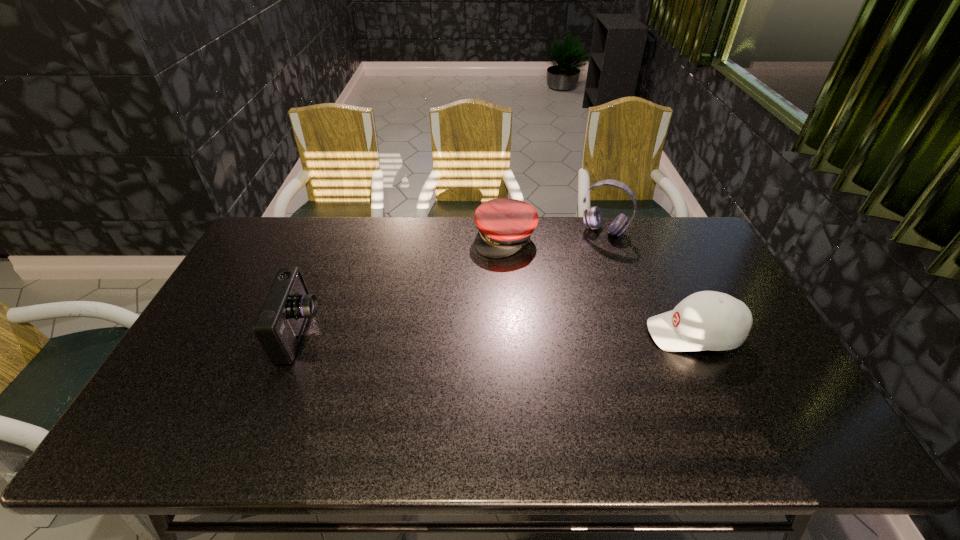
Where is `unoccupied position between the tallest object and the baseball cap`? unoccupied position between the tallest object and the baseball cap is located at coordinates (649, 282).

Locate an element on the screen. free space that is in between the camera and the baseball cap is located at coordinates point(497,334).

At what (x,y) coordinates should I click in order to perform the action: click on vacant space that is in between the tallest object and the second object from left to right. Please return your answer as a coordinate pair (x, y). Image resolution: width=960 pixels, height=540 pixels. Looking at the image, I should click on (555, 235).

You are a GUI agent. You are given a task and a screenshot of the screen. Output one action in this format:
    pyautogui.click(x=<x>, y=<y>)
    Task: Click on the vacant area that lies between the shortest object and the headset
    The height and width of the screenshot is (540, 960).
    Given the screenshot: What is the action you would take?
    (555, 235)

Locate an element on the screen. object that stands as the third closest to the headset is located at coordinates (279, 326).

Identify which object is the second nearest to the second object from left to right. Please provide its 2D coordinates. Your answer should be formatted as a tuple, i.e. [(x, y)], where the tuple contains the x and y coordinates of a point satisfying the conditions above.

[(708, 320)]

Locate an element on the screen. free region that satisfies the following two spatial constraints: 1. on the front side of the headset; 2. on the front-facing side of the third tallest object is located at coordinates [x=639, y=334].

At what (x,y) coordinates should I click in order to perform the action: click on vacant area in the image that satisfies the following two spatial constraints: 1. on the back side of the shortest object; 2. on the right side of the tallest object. Please return your answer as a coordinate pair (x, y). The width and height of the screenshot is (960, 540). Looking at the image, I should click on (505, 231).

What are the coordinates of `vacant space that satisfies the following two spatial constraints: 1. on the front side of the baseball cap; 2. on the front-facing side of the tallest object` in the screenshot? It's located at (639, 334).